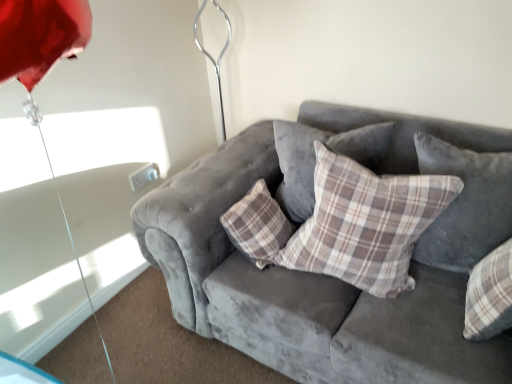
Where is `plaid fabric pillow at center, positioned as the 1th pillow in left-to-right order`? plaid fabric pillow at center, positioned as the 1th pillow in left-to-right order is located at coordinates (315, 159).

In order to face plaid fabric pillow at center, which is counted as the 1th pillow, starting from the right, should I rotate leftwards or rightwards?

To face it directly, rotate right by 26.073 degrees.

Locate an element on the screen. The image size is (512, 384). white plastic electric outlet at lower left is located at coordinates (144, 176).

From the image's perspective, would you say velvet gray couch at center is positioned over plaid fabric pillow at center, arranged as the 3th pillow when viewed from the left?

No, from the image's perspective, velvet gray couch at center is not above plaid fabric pillow at center, arranged as the 3th pillow when viewed from the left.

In the image, is velvet gray couch at center positioned in front of or behind plaid fabric pillow at center, which is counted as the 1th pillow, starting from the right?

In the image, velvet gray couch at center appears in front of plaid fabric pillow at center, which is counted as the 1th pillow, starting from the right.

From a real-world perspective, is velvet gray couch at center on top of plaid fabric pillow at center, which is counted as the 1th pillow, starting from the right?

Actually, velvet gray couch at center is physically below plaid fabric pillow at center, which is counted as the 1th pillow, starting from the right, in the real world.

Consider the image. Considering the sizes of velvet gray couch at center and plaid fabric pillow at center, which is counted as the 1th pillow, starting from the right, in the image, is velvet gray couch at center bigger or smaller than plaid fabric pillow at center, which is counted as the 1th pillow, starting from the right,?

Clearly, velvet gray couch at center is larger in size than plaid fabric pillow at center, which is counted as the 1th pillow, starting from the right.

This screenshot has height=384, width=512. Find the location of `pillow behind the plaid fabric pillow at center, arranged as the 3th pillow when viewed from the left`. pillow behind the plaid fabric pillow at center, arranged as the 3th pillow when viewed from the left is located at coordinates (315, 159).

Could you tell me if plaid fabric pillow at center, arranged as the 3th pillow when viewed from the left, is turned towards plaid fabric pillow at center, positioned as the third pillow in right-to-left order?

No, plaid fabric pillow at center, arranged as the 3th pillow when viewed from the left, is not facing towards plaid fabric pillow at center, positioned as the third pillow in right-to-left order.

Is point (467, 212) positioned after point (289, 139)?

No, it is not.

Looking at the image, does plaid fabric pillow at center, arranged as the 3th pillow when viewed from the left, seem bigger or smaller compared to plaid fabric pillow at center, positioned as the third pillow in right-to-left order?

In the image, plaid fabric pillow at center, arranged as the 3th pillow when viewed from the left, appears to be smaller than plaid fabric pillow at center, positioned as the third pillow in right-to-left order.

Who is more distant, plaid fabric pillow at center, arranged as the 3th pillow when viewed from the left, or velvet gray couch at center?

plaid fabric pillow at center, arranged as the 3th pillow when viewed from the left.

Who is smaller, plaid fabric pillow at center, arranged as the 3th pillow when viewed from the left, or velvet gray couch at center?

plaid fabric pillow at center, arranged as the 3th pillow when viewed from the left.

Considering the sizes of plaid fabric pillow at center, arranged as the 3th pillow when viewed from the left, and velvet gray couch at center in the image, is plaid fabric pillow at center, arranged as the 3th pillow when viewed from the left, taller or shorter than velvet gray couch at center?

plaid fabric pillow at center, arranged as the 3th pillow when viewed from the left, is shorter than velvet gray couch at center.

Between plaid fabric pillow at center, which is counted as the 1th pillow, starting from the right, and velvet gray couch at center, which one appears on the right side from the viewer's perspective?

plaid fabric pillow at center, which is counted as the 1th pillow, starting from the right.

Is plaid fabric pillow at center, positioned as the third pillow in right-to-left order, at the left side of plaid fabric pillow at center, the second pillow positioned from the left?

Yes.

Can you confirm if plaid fabric pillow at center, positioned as the third pillow in right-to-left order, is taller than plaid fabric pillow at center, the second pillow positioned from the left?

Incorrect, the height of plaid fabric pillow at center, positioned as the third pillow in right-to-left order, is not larger of that of plaid fabric pillow at center, the second pillow positioned from the left.

Is plaid fabric pillow at center, positioned as the third pillow in right-to-left order, positioned with its back to plaid fabric pillow at center, the 2th pillow from the right?

plaid fabric pillow at center, positioned as the third pillow in right-to-left order, is not turned away from plaid fabric pillow at center, the 2th pillow from the right.

Is plaid fabric pillow at center, positioned as the third pillow in right-to-left order, outside of plaid fabric pillow at center, the 2th pillow from the right?

Yes, plaid fabric pillow at center, positioned as the third pillow in right-to-left order, is located beyond the bounds of plaid fabric pillow at center, the 2th pillow from the right.

In the scene shown: Is plaid fabric pillow at center, positioned as the third pillow in right-to-left order, in front of or behind white plastic electric outlet at lower left in the image?

plaid fabric pillow at center, positioned as the third pillow in right-to-left order, is in front of white plastic electric outlet at lower left.

Is white plastic electric outlet at lower left surrounded by plaid fabric pillow at center, positioned as the third pillow in right-to-left order?

Actually, white plastic electric outlet at lower left is outside plaid fabric pillow at center, positioned as the third pillow in right-to-left order.

Consider the image. Is plaid fabric pillow at center, positioned as the third pillow in right-to-left order, aimed at white plastic electric outlet at lower left?

No, plaid fabric pillow at center, positioned as the third pillow in right-to-left order, is not aimed at white plastic electric outlet at lower left.

How distant is plaid fabric pillow at center, positioned as the 1th pillow in left-to-right order, from white plastic electric outlet at lower left?

The distance of plaid fabric pillow at center, positioned as the 1th pillow in left-to-right order, from white plastic electric outlet at lower left is 32.48 inches.

From the image's perspective, would you say white plastic electric outlet at lower left is positioned over velvet gray couch at center?

Yes.

Considering the relative sizes of white plastic electric outlet at lower left and velvet gray couch at center in the image provided, is white plastic electric outlet at lower left bigger than velvet gray couch at center?

No, white plastic electric outlet at lower left is not bigger than velvet gray couch at center.

Is white plastic electric outlet at lower left aimed at velvet gray couch at center?

Yes, white plastic electric outlet at lower left faces towards velvet gray couch at center.

Where is `studio couch below the white plastic electric outlet at lower left (from the image's perspective)`? The height and width of the screenshot is (384, 512). studio couch below the white plastic electric outlet at lower left (from the image's perspective) is located at coordinates (300, 290).

Can you confirm if velvet gray couch at center is taller than plaid fabric pillow at center, positioned as the 1th pillow in left-to-right order?

Indeed, velvet gray couch at center has a greater height compared to plaid fabric pillow at center, positioned as the 1th pillow in left-to-right order.

In terms of width, does velvet gray couch at center look wider or thinner when compared to plaid fabric pillow at center, positioned as the 1th pillow in left-to-right order?

velvet gray couch at center is wider than plaid fabric pillow at center, positioned as the 1th pillow in left-to-right order.

Is plaid fabric pillow at center, positioned as the 1th pillow in left-to-right order, at the back of velvet gray couch at center?

Yes.

Looking at this image, is velvet gray couch at center closer to camera compared to plaid fabric pillow at center, positioned as the 1th pillow in left-to-right order?

Yes, it is.

Where is `studio couch on the left of plaid fabric pillow at center, arranged as the 3th pillow when viewed from the left`? studio couch on the left of plaid fabric pillow at center, arranged as the 3th pillow when viewed from the left is located at coordinates (300, 290).

Locate an element on the screen. The image size is (512, 384). the 2nd pillow counting from the right of the plaid fabric pillow at center, positioned as the 1th pillow in left-to-right order is located at coordinates (465, 205).

Based on their spatial positions, is plaid fabric pillow at center, the second pillow positioned from the left, or plaid fabric pillow at center, which is counted as the 1th pillow, starting from the right, closer to plaid fabric pillow at center, positioned as the 1th pillow in left-to-right order?

plaid fabric pillow at center, the second pillow positioned from the left, is positioned closer to the anchor plaid fabric pillow at center, positioned as the 1th pillow in left-to-right order.

From the image, which object appears to be farther from white plastic electric outlet at lower left, plaid fabric pillow at center, arranged as the 3th pillow when viewed from the left, or velvet gray couch at center?

plaid fabric pillow at center, arranged as the 3th pillow when viewed from the left.

Which object lies nearer to the anchor point metallic silver umbrella at upper center, velvet gray couch at center or plaid fabric pillow at center, arranged as the 3th pillow when viewed from the left?

velvet gray couch at center.

When comparing their distances from metallic silver umbrella at upper center, does plaid fabric pillow at center, positioned as the 1th pillow in left-to-right order, or white plastic electric outlet at lower left seem further?

white plastic electric outlet at lower left lies further to metallic silver umbrella at upper center than the other object.

In the scene shown: Which object lies nearer to the anchor point metallic silver umbrella at upper center, white plastic electric outlet at lower left or velvet gray couch at center?

The object closer to metallic silver umbrella at upper center is velvet gray couch at center.

Which object lies further to the anchor point plaid fabric pillow at center, positioned as the 1th pillow in left-to-right order, plaid fabric pillow at center, the 2th pillow from the right, or velvet gray couch at center?

Based on the image, velvet gray couch at center appears to be further to plaid fabric pillow at center, positioned as the 1th pillow in left-to-right order.

Estimate the real-world distances between objects in this image. Which object is further from velvet gray couch at center, white plastic electric outlet at lower left or metallic silver umbrella at upper center?

Based on the image, metallic silver umbrella at upper center appears to be further to velvet gray couch at center.

From the image, which object appears to be farther from velvet gray couch at center, plaid fabric pillow at center, positioned as the 1th pillow in left-to-right order, or plaid fabric pillow at center, the second pillow positioned from the left?

Based on the image, plaid fabric pillow at center, positioned as the 1th pillow in left-to-right order, appears to be further to velvet gray couch at center.

You are a GUI agent. You are given a task and a screenshot of the screen. Output one action in this format:
    pyautogui.click(x=<x>, y=<y>)
    Task: Click on the studio couch positioned between metallic silver umbrella at upper center and white plastic electric outlet at lower left from near to far
    The height and width of the screenshot is (384, 512).
    Given the screenshot: What is the action you would take?
    pyautogui.click(x=300, y=290)

At what (x,y) coordinates should I click in order to perform the action: click on studio couch between metallic silver umbrella at upper center and plaid fabric pillow at center, positioned as the third pillow in right-to-left order, from front to back. Please return your answer as a coordinate pair (x, y). Image resolution: width=512 pixels, height=384 pixels. Looking at the image, I should click on (300, 290).

Where is `pillow between plaid fabric pillow at center, positioned as the third pillow in right-to-left order, and plaid fabric pillow at center, which is counted as the 1th pillow, starting from the right, from left to right`? pillow between plaid fabric pillow at center, positioned as the third pillow in right-to-left order, and plaid fabric pillow at center, which is counted as the 1th pillow, starting from the right, from left to right is located at coordinates [x=366, y=224].

Locate an element on the screen. studio couch between white plastic electric outlet at lower left and plaid fabric pillow at center, arranged as the 3th pillow when viewed from the left is located at coordinates (300, 290).